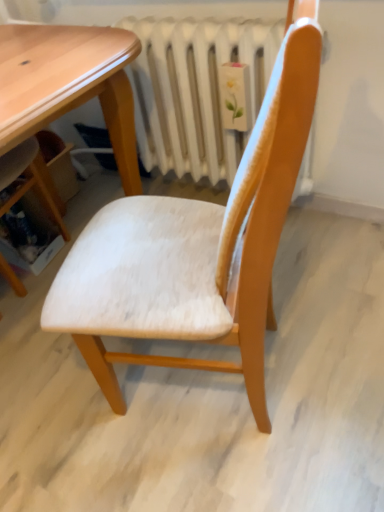
This screenshot has width=384, height=512. What are the coordinates of `empty space that is to the right of white fabric chair at center` in the screenshot? It's located at (327, 338).